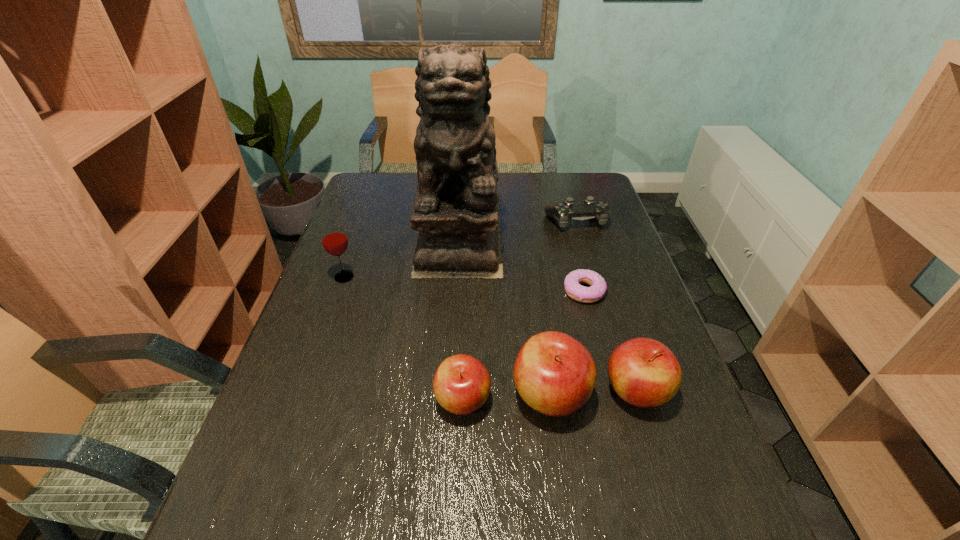
Please point a spot on the left to add another apple. Please provide its 2D coordinates. Your answer should be formatted as a tuple, i.e. [(x, y)], where the tuple contains the x and y coordinates of a point satisfying the conditions above.

[(373, 404)]